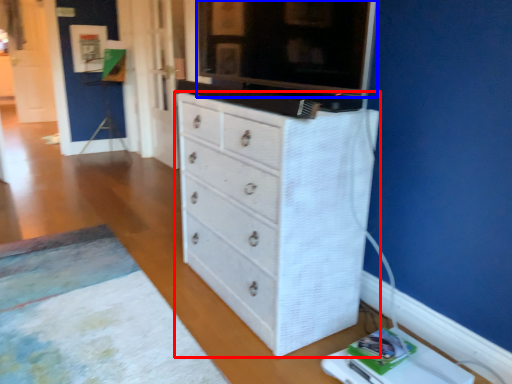
Question: Among these objects, which one is farthest to the camera, chest of drawers (highlighted by a red box) or tv cabinet (highlighted by a blue box)?

Choices:
 (A) chest of drawers
 (B) tv cabinet

Answer: (A)